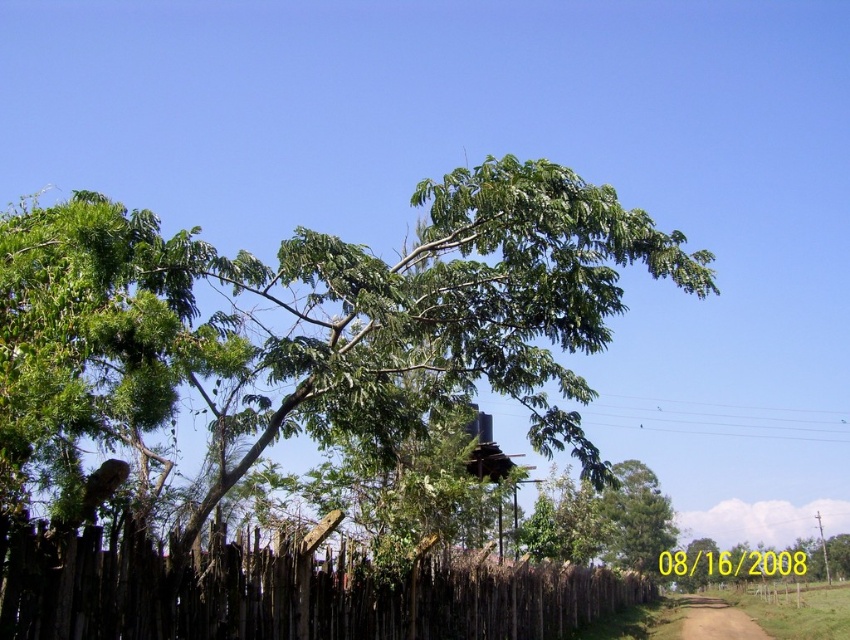
Is green leafy tree at center to the right of brown wooden fence at lower left from the viewer's perspective?

Indeed, green leafy tree at center is positioned on the right side of brown wooden fence at lower left.

Is green leafy tree at center wider than brown wooden fence at lower left?

Incorrect, green leafy tree at center's width does not surpass brown wooden fence at lower left's.

Identify the location of green leafy tree at center. This screenshot has height=640, width=850. (326, 320).

Does green leafy tree at center have a lesser width compared to brown dirt track at lower center?

Yes, green leafy tree at center is thinner than brown dirt track at lower center.

Who is more forward, [246,353] or [740,625]?

Point [246,353]

Is point (630, 237) positioned after point (741, 625)?

No.

Identify the location of green leafy tree at center. The height and width of the screenshot is (640, 850). (326, 320).

Can you confirm if brown wooden fence at lower left is smaller than brown dirt track at lower center?

Correct, brown wooden fence at lower left occupies less space than brown dirt track at lower center.

Can you confirm if brown wooden fence at lower left is positioned below brown dirt track at lower center?

Actually, brown wooden fence at lower left is above brown dirt track at lower center.

Who is more distant from viewer, (129, 552) or (703, 600)?

The point (703, 600) is behind.

The height and width of the screenshot is (640, 850). What are the coordinates of `brown wooden fence at lower left` in the screenshot? It's located at (282, 593).